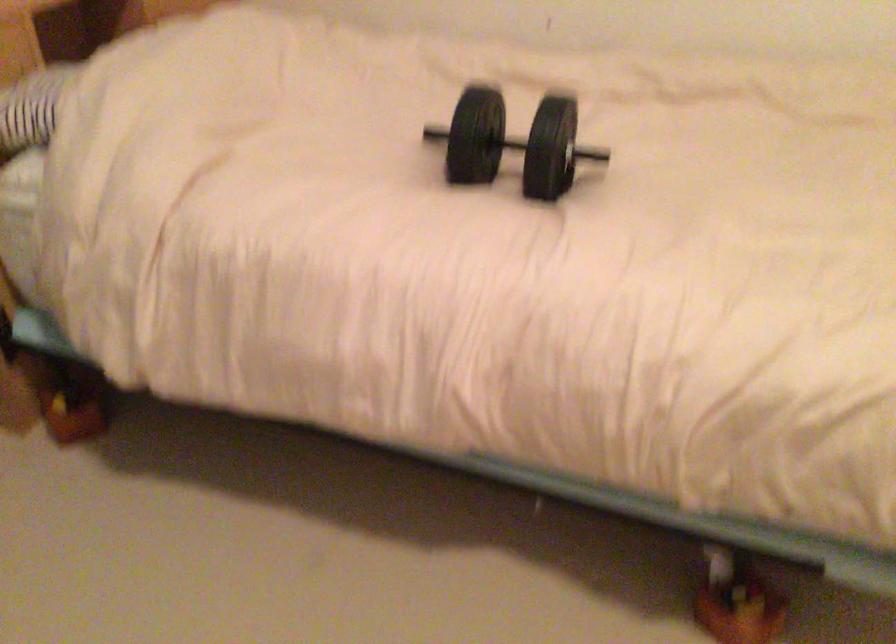
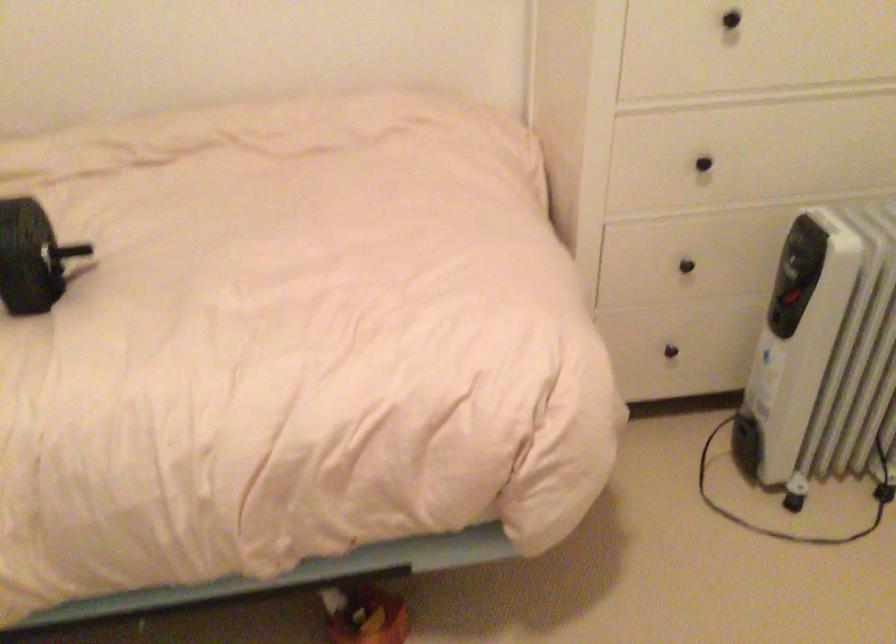
In the second image, find the point that corresponds to (556,154) in the first image.

(30, 257)